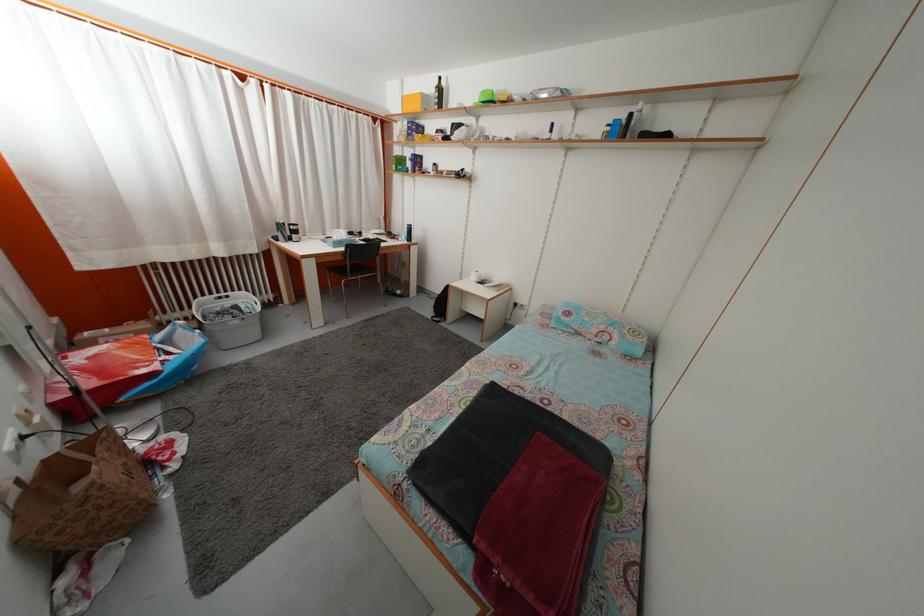
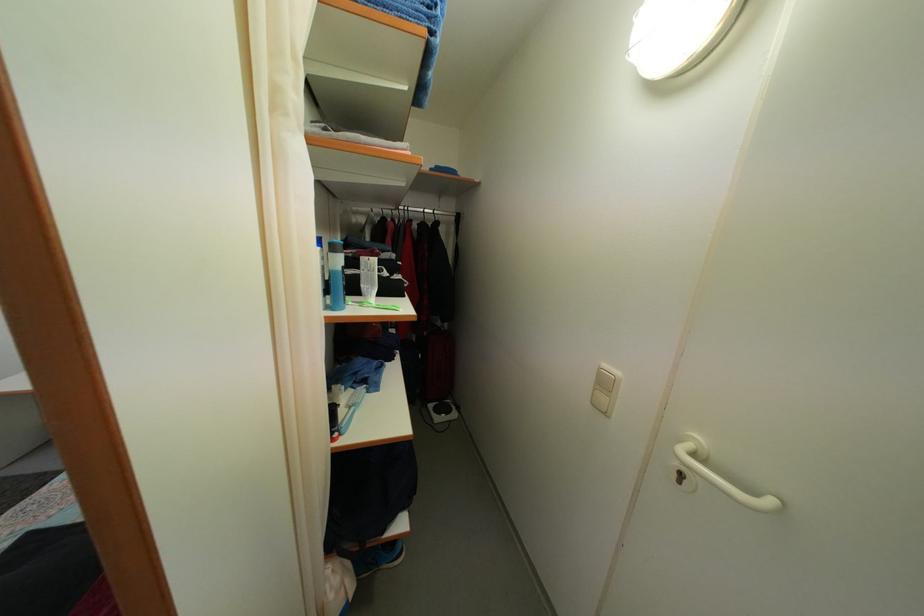
Question: The images are taken continuously from a first-person perspective. In which direction is your viewpoint rotating?

Choices:
 (A) Left
 (B) Right
 (C) Up
 (D) Down

Answer: (B)